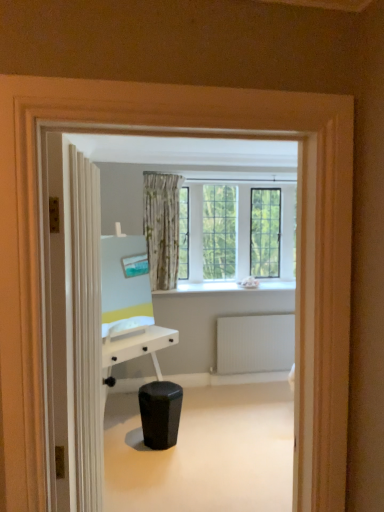
Question: From a real-world perspective, is black matte music stool at center under white smooth window sill at center?

Choices:
 (A) yes
 (B) no

Answer: (A)

Question: Considering the relative sizes of black matte music stool at center and white smooth window sill at center in the image provided, is black matte music stool at center bigger than white smooth window sill at center?

Choices:
 (A) no
 (B) yes

Answer: (A)

Question: Is black matte music stool at center facing away from white smooth window sill at center?

Choices:
 (A) no
 (B) yes

Answer: (A)

Question: Is black matte music stool at center at the left side of white smooth window sill at center?

Choices:
 (A) no
 (B) yes

Answer: (B)

Question: Does black matte music stool at center appear on the right side of white smooth window sill at center?

Choices:
 (A) no
 (B) yes

Answer: (A)

Question: Considering their positions, is white matte radiator at lower right located in front of or behind white textured door at left?

Choices:
 (A) behind
 (B) front

Answer: (A)

Question: Is white matte radiator at lower right situated inside white textured door at left or outside?

Choices:
 (A) outside
 (B) inside

Answer: (A)

Question: From the image's perspective, relative to white textured door at left, is white matte radiator at lower right above or below?

Choices:
 (A) below
 (B) above

Answer: (A)

Question: From a real-world perspective, relative to white textured door at left, is white matte radiator at lower right vertically above or below?

Choices:
 (A) below
 (B) above

Answer: (A)

Question: Considering the positions of white textured door at left and white smooth window sill at center in the image, is white textured door at left taller or shorter than white smooth window sill at center?

Choices:
 (A) short
 (B) tall

Answer: (B)

Question: From the image's perspective, relative to white smooth window sill at center, is white textured door at left above or below?

Choices:
 (A) below
 (B) above

Answer: (A)

Question: Is white textured door at left inside or outside of white smooth window sill at center?

Choices:
 (A) inside
 (B) outside

Answer: (B)

Question: Is point (59, 373) positioned closer to the camera than point (215, 284)?

Choices:
 (A) closer
 (B) farther

Answer: (A)

Question: From a real-world perspective, is white matte radiator at lower right positioned above or below white smooth window sill at center?

Choices:
 (A) below
 (B) above

Answer: (A)

Question: In the image, is white matte radiator at lower right on the left side or the right side of white smooth window sill at center?

Choices:
 (A) left
 (B) right

Answer: (B)